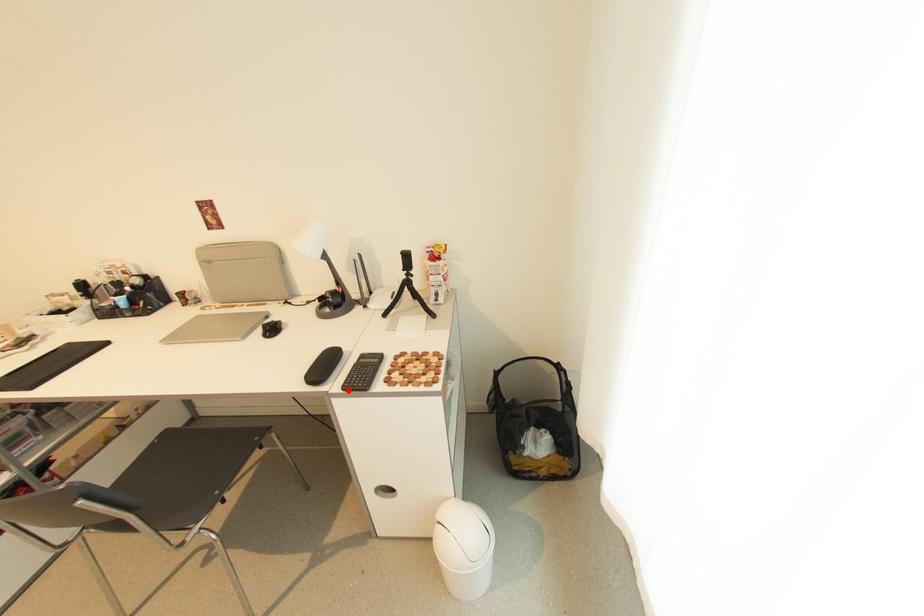
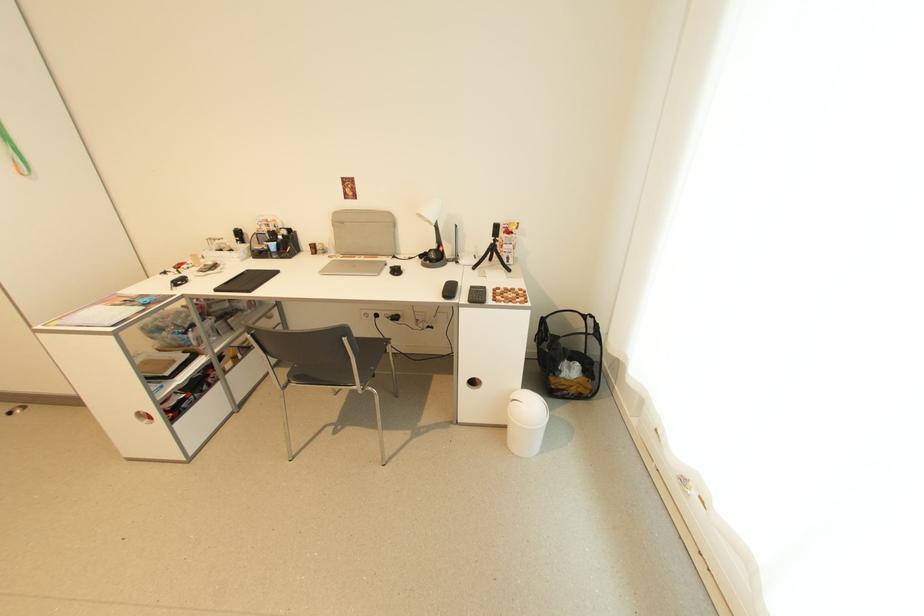
Locate, in the second image, the point that corresponds to the highlighted location in the first image.

(473, 302)